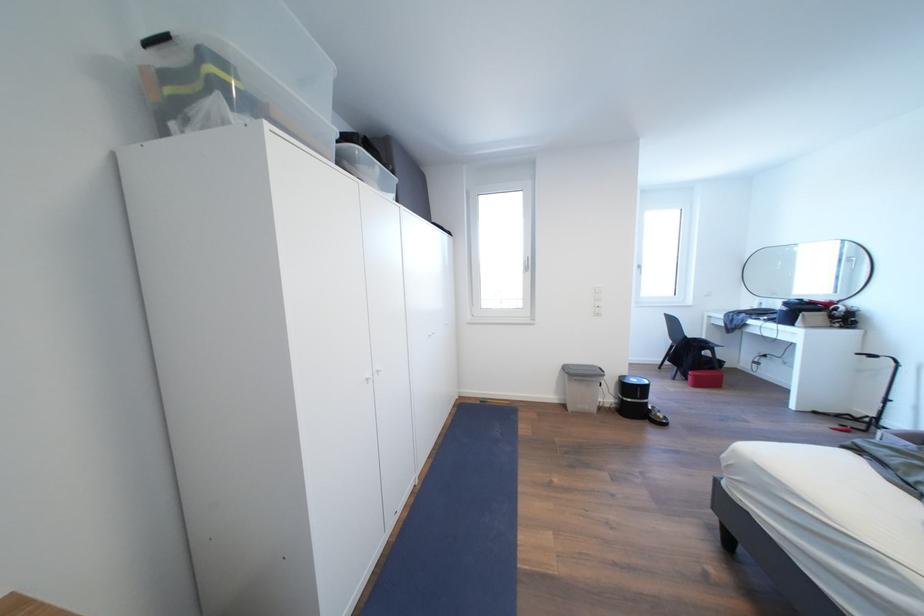
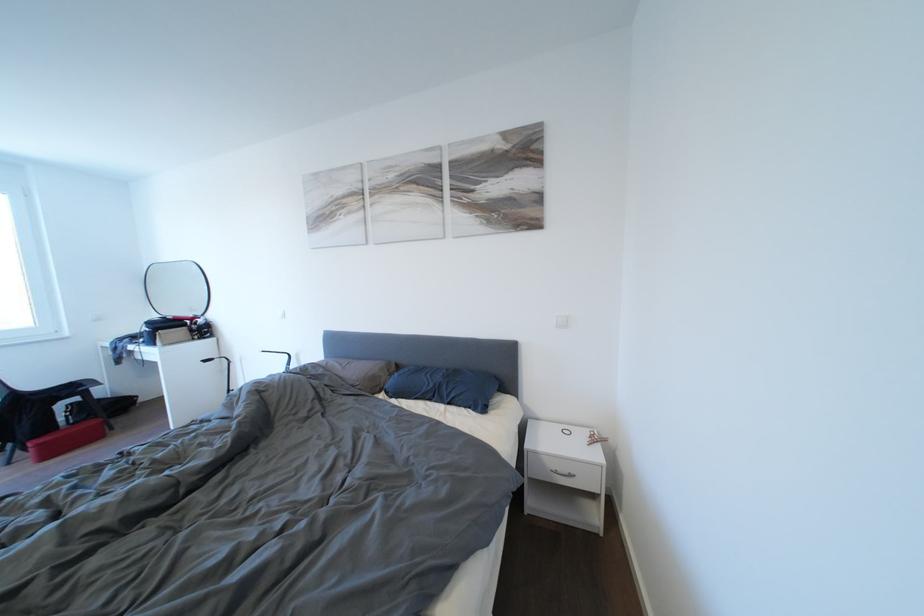
Where in the second image is the point corresponding to point 703,381 from the first image?

(46, 450)